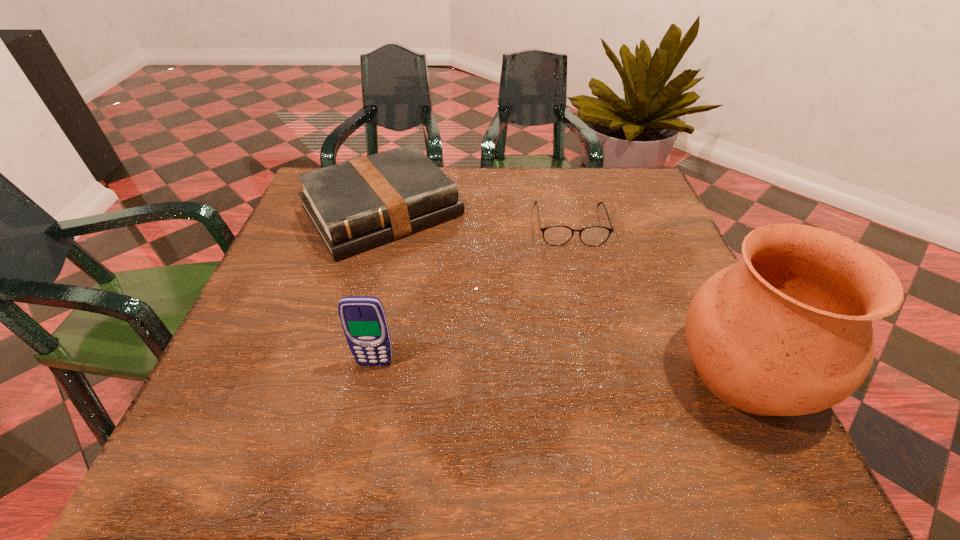
Locate an element on the screen. Image resolution: width=960 pixels, height=540 pixels. free point located on the spine side of the hardback book is located at coordinates (430, 267).

The width and height of the screenshot is (960, 540). Find the location of `free space located on the spine side of the hardback book`. free space located on the spine side of the hardback book is located at coordinates (439, 278).

Where is `vacant area located 0.190m on the spine side of the hardback book`? The width and height of the screenshot is (960, 540). vacant area located 0.190m on the spine side of the hardback book is located at coordinates (462, 307).

You are a GUI agent. You are given a task and a screenshot of the screen. Output one action in this format:
    pyautogui.click(x=<x>, y=<y>)
    Task: Click on the spectacles situated at the far edge
    The width and height of the screenshot is (960, 540).
    Given the screenshot: What is the action you would take?
    pyautogui.click(x=556, y=235)

The height and width of the screenshot is (540, 960). In order to click on hardback book located in the far edge section of the desktop in this screenshot , I will do `click(356, 205)`.

This screenshot has width=960, height=540. Identify the location of object situated at the near edge. (787, 331).

Find the location of `object located at the left edge`. object located at the left edge is located at coordinates (356, 205).

The image size is (960, 540). I want to click on pottery located in the right edge section of the desktop, so click(x=787, y=331).

This screenshot has width=960, height=540. In order to click on spectacles that is positioned at the right edge in this screenshot , I will do `click(556, 235)`.

Where is `object present at the far left corner`? The height and width of the screenshot is (540, 960). object present at the far left corner is located at coordinates (356, 205).